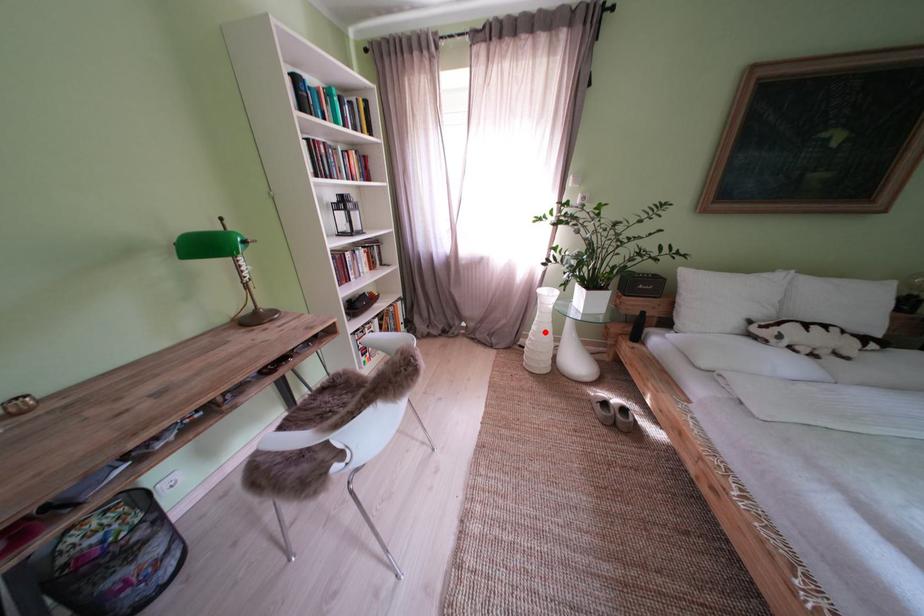
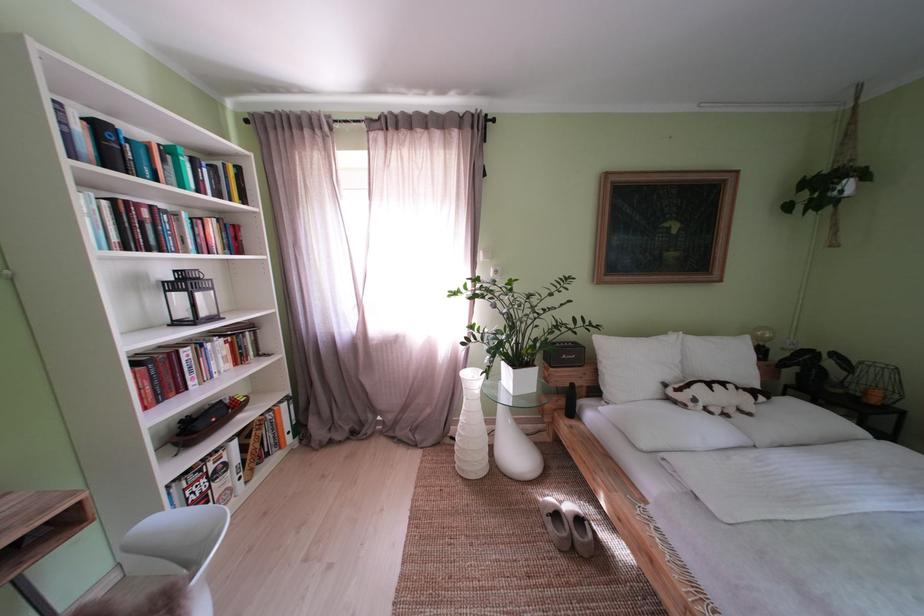
Question: I am providing you with two images of the same scene from different viewpoints. Given a red point in image1, look at the same physical point in image2. Is it:

Choices:
 (A) Closer to the viewpoint
 (B) Farther from the viewpoint

Answer: (B)